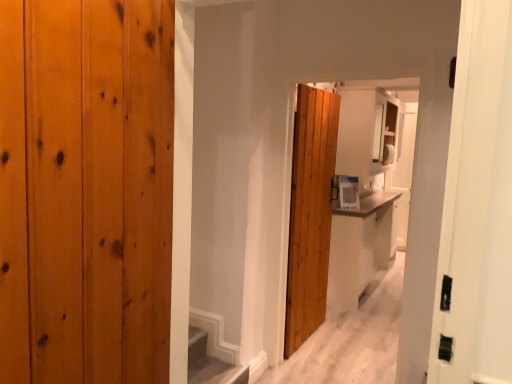
What are the coordinates of `white glossy vanity at center` in the screenshot? It's located at (360, 248).

What do you see at coordinates (360, 248) in the screenshot?
I see `white glossy vanity at center` at bounding box center [360, 248].

What is the approximate height of white glossy vanity at center?

white glossy vanity at center is 35.05 inches tall.

You are a GUI agent. You are given a task and a screenshot of the screen. Output one action in this format:
    pyautogui.click(x=<x>, y=<y>)
    Task: Click on the white glossy vanity at center
    The height and width of the screenshot is (384, 512).
    Given the screenshot: What is the action you would take?
    pyautogui.click(x=360, y=248)